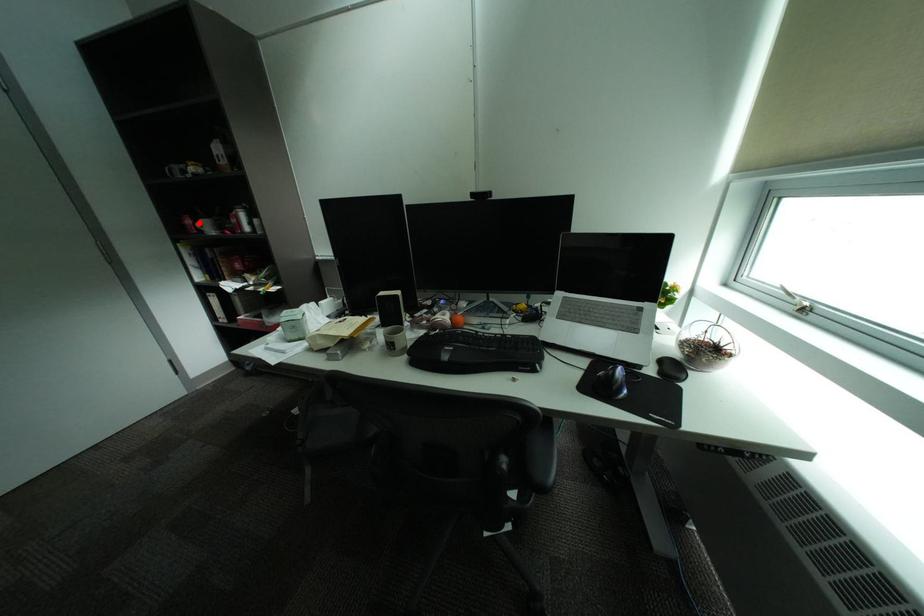
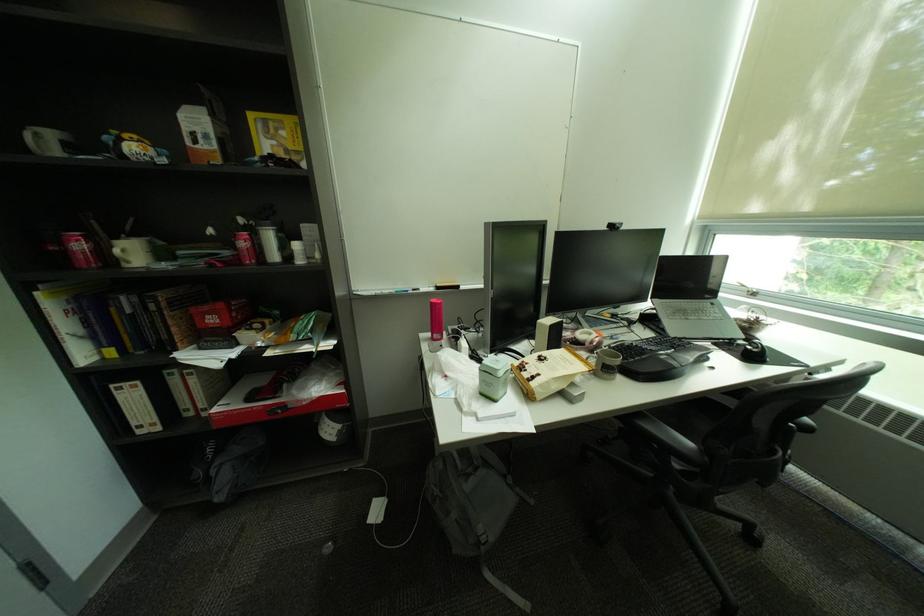
Find the pixel in the second image that matches the highlighted location in the first image.

(91, 246)